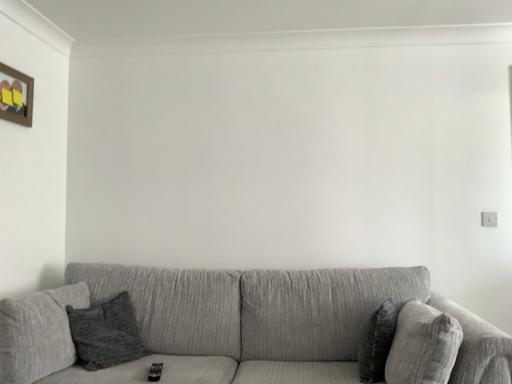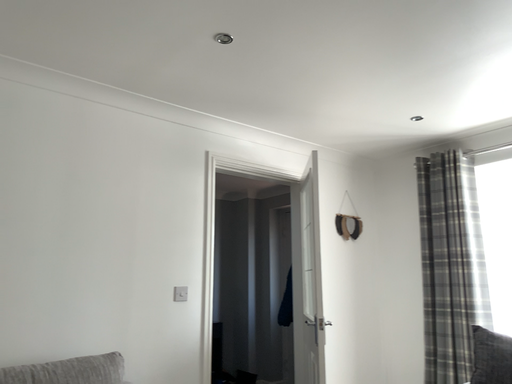
Question: Which way did the camera rotate in the video?

Choices:
 (A) rotated downward
 (B) rotated upward

Answer: (B)